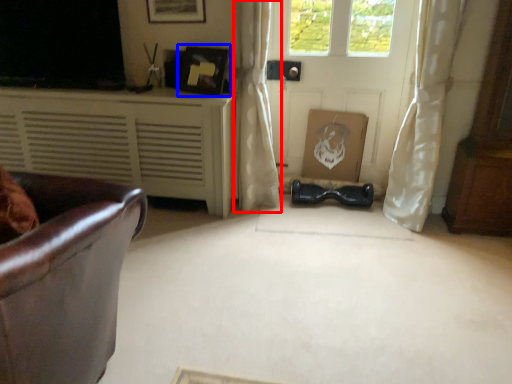
Question: Among these objects, which one is farthest to the camera, curtain (highlighted by a red box) or picture frame (highlighted by a blue box)?

Choices:
 (A) curtain
 (B) picture frame

Answer: (B)